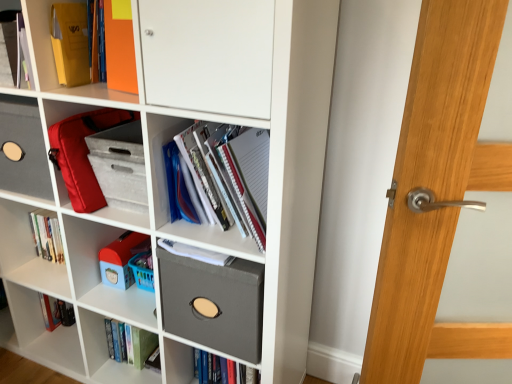
Question: From the image's perspective, is green matte book at lower center, the 2th book viewed from the right, positioned above or below matte gray fabric box at center, the 1th shelf from the right?

Choices:
 (A) above
 (B) below

Answer: (B)

Question: From a real-world perspective, relative to matte gray fabric box at center, which is the third shelf in top-to-bottom order, is green matte book at lower center, arranged as the 2th book when viewed from the top, vertically above or below?

Choices:
 (A) above
 (B) below

Answer: (B)

Question: Considering the real-world distances, which object is farthest from the green matte book at lower center, arranged as the 2th book when viewed from the top?

Choices:
 (A) white paper notebook at center, which is the second book from bottom to top
 (B) matte gray fabric box at center, which is the third shelf in top-to-bottom order
 (C) orange matte folder at upper left, acting as the third shelf starting from the right
 (D) matte red bag at center-left, which is the second shelf in bottom-to-top order
 (E) plastic toy at lower left

Answer: (C)

Question: Estimate the real-world distances between objects in this image. Which object is farther from the matte gray fabric box at center, the 1th shelf from the right?

Choices:
 (A) matte gray fabric storage bin at center
 (B) orange matte folder at upper left, acting as the third shelf starting from the right
 (C) matte red bag at center-left, which is counted as the second shelf, starting from the top
 (D) white paper notebook at center, the 1th book from the right
 (E) green matte book at lower center, marked as the 1th book in a bottom-to-top arrangement

Answer: (B)